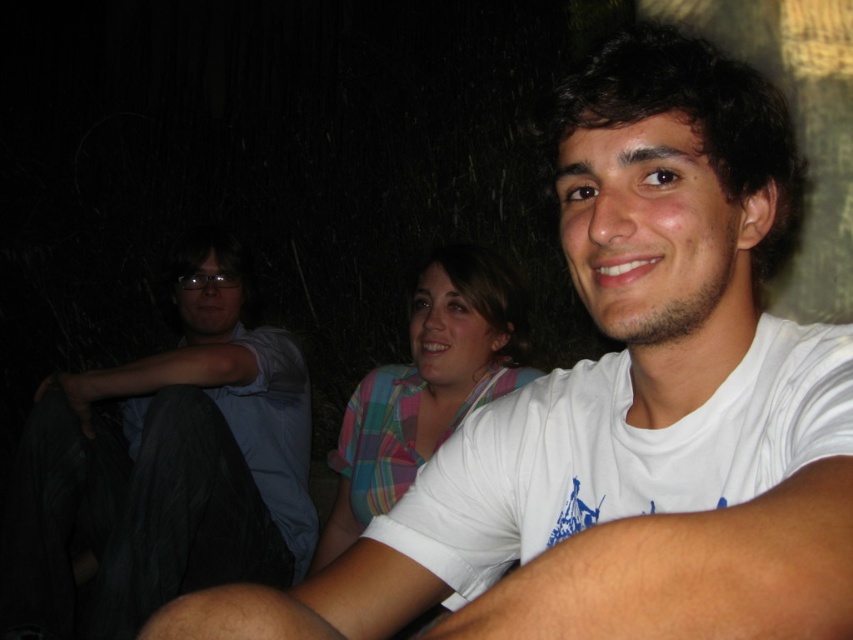
Question: Does light blue shirt at left appear on the right side of plaid fabric shirt at center?

Choices:
 (A) no
 (B) yes

Answer: (A)

Question: Is light blue shirt at left positioned at the back of plaid fabric shirt at center?

Choices:
 (A) no
 (B) yes

Answer: (B)

Question: In this image, where is light blue shirt at left located relative to plaid fabric shirt at center?

Choices:
 (A) left
 (B) right

Answer: (A)

Question: Which object is closer to the camera taking this photo?

Choices:
 (A) plaid fabric shirt at center
 (B) light blue shirt at left

Answer: (A)